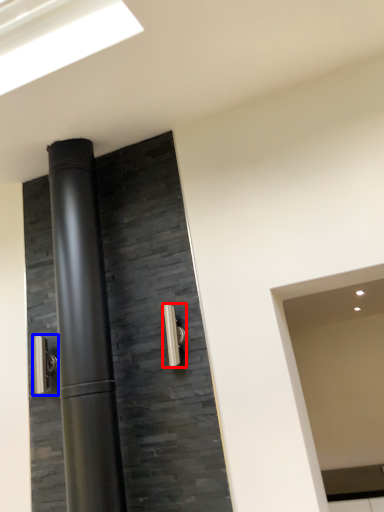
Question: Among these objects, which one is farthest to the camera, door handle (highlighted by a red box) or door handle (highlighted by a blue box)?

Choices:
 (A) door handle
 (B) door handle

Answer: (B)